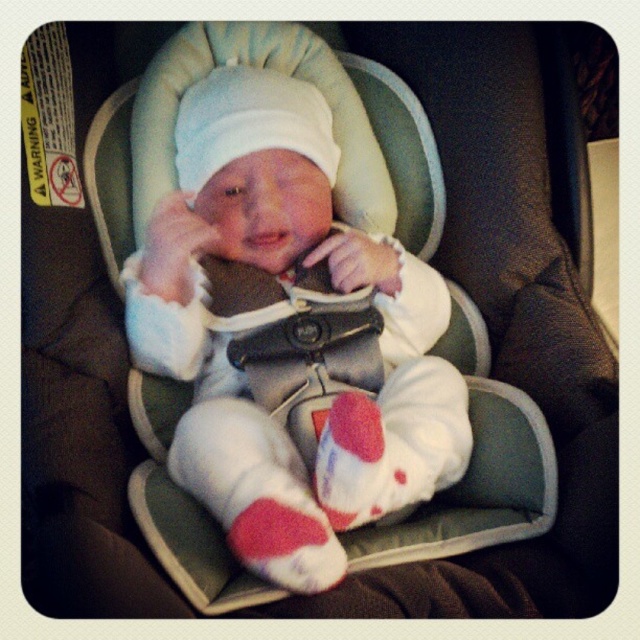
Question: Is white soft baby at center below red knit sock at lower center?

Choices:
 (A) no
 (B) yes

Answer: (A)

Question: Which object is closer to the camera taking this photo?

Choices:
 (A) white soft baby at center
 (B) red knit sock at lower center

Answer: (B)

Question: Which point is farther from the camera taking this photo?

Choices:
 (A) (291, 412)
 (B) (275, 550)

Answer: (A)

Question: Does white soft baby at center have a smaller size compared to red knit sock at lower center?

Choices:
 (A) yes
 (B) no

Answer: (B)

Question: Is the position of white soft baby at center less distant than that of red knit sock at lower center?

Choices:
 (A) no
 (B) yes

Answer: (A)

Question: Which point is closer to the camera taking this photo?

Choices:
 (A) (253, 524)
 (B) (163, 294)

Answer: (A)